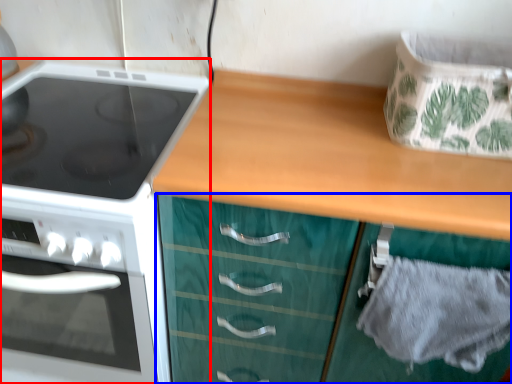
Question: Among these objects, which one is nearest to the camera, kitchen appliance (highlighted by a red box) or cabinetry (highlighted by a blue box)?

Choices:
 (A) kitchen appliance
 (B) cabinetry

Answer: (B)